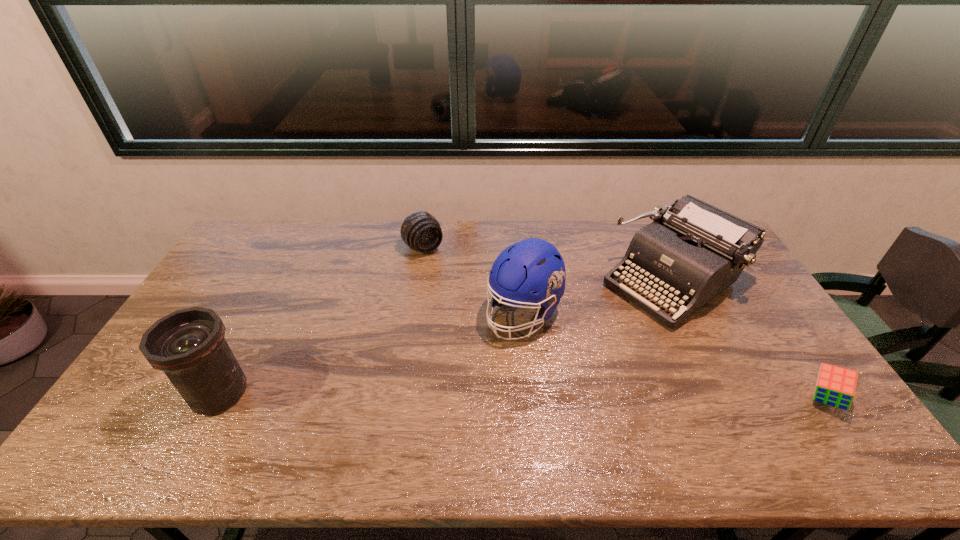
Locate an element on the screen. telephoto lens at the near edge is located at coordinates (188, 345).

The width and height of the screenshot is (960, 540). In order to click on cube at the near edge in this screenshot , I will do `click(835, 386)`.

This screenshot has height=540, width=960. I want to click on object present at the left edge, so click(x=188, y=345).

Where is `cube that is at the right edge`? This screenshot has height=540, width=960. cube that is at the right edge is located at coordinates (835, 386).

At what (x,y) coordinates should I click in order to perform the action: click on typewriter located at the right edge. Please return your answer as a coordinate pair (x, y). Image resolution: width=960 pixels, height=540 pixels. Looking at the image, I should click on (692, 251).

Find the location of a particular element. The height and width of the screenshot is (540, 960). object positioned at the near left corner is located at coordinates (188, 345).

Locate an element on the screen. The width and height of the screenshot is (960, 540). object at the far right corner is located at coordinates (692, 251).

I want to click on object at the near right corner, so click(835, 386).

Locate an element on the screen. The height and width of the screenshot is (540, 960). vacant region at the far edge is located at coordinates (613, 253).

This screenshot has height=540, width=960. Find the location of `free space at the left edge of the desktop`. free space at the left edge of the desktop is located at coordinates (257, 276).